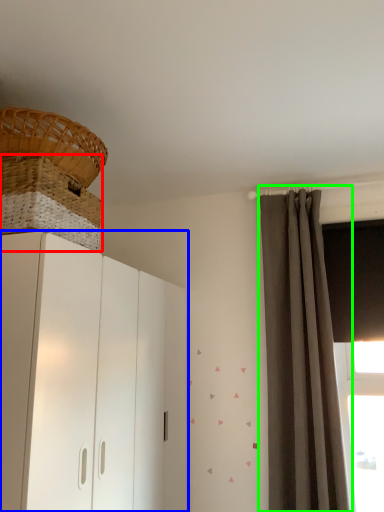
Question: Considering the real-world distances, which object is closest to basket (highlighted by a red box)? cupboard (highlighted by a blue box) or curtain (highlighted by a green box).

Choices:
 (A) cupboard
 (B) curtain

Answer: (A)